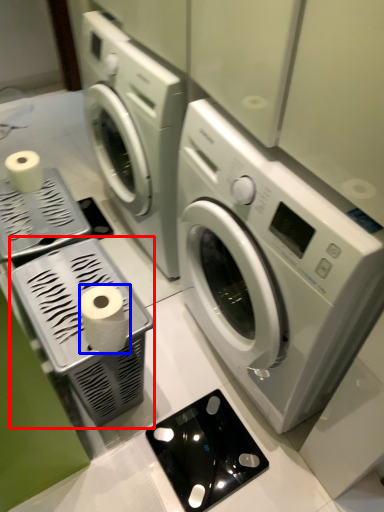
Question: Among these objects, which one is farthest to the camera, appliance (highlighted by a red box) or toilet paper (highlighted by a blue box)?

Choices:
 (A) appliance
 (B) toilet paper

Answer: (A)